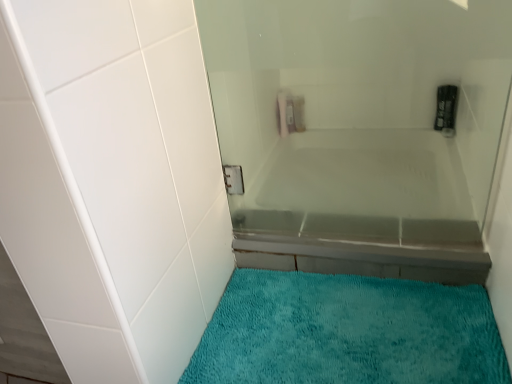
Locate an element on the screen. This screenshot has height=384, width=512. blank space situated above teal plush bath mat at lower center (from a real-world perspective) is located at coordinates (332, 325).